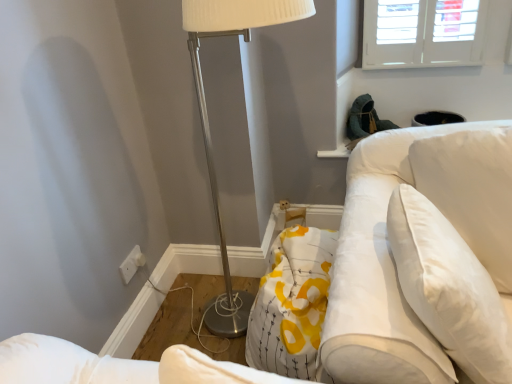
Question: Is metallic silver floor lamp at center facing towards white fabric swivel chair at right?

Choices:
 (A) no
 (B) yes

Answer: (A)

Question: Is metallic silver floor lamp at center beside white fabric swivel chair at right?

Choices:
 (A) no
 (B) yes

Answer: (A)

Question: Is metallic silver floor lamp at center in front of white fabric swivel chair at right?

Choices:
 (A) no
 (B) yes

Answer: (B)

Question: Can you confirm if metallic silver floor lamp at center is bigger than white fabric swivel chair at right?

Choices:
 (A) yes
 (B) no

Answer: (A)

Question: Is metallic silver floor lamp at center at the left side of white fabric swivel chair at right?

Choices:
 (A) no
 (B) yes

Answer: (B)

Question: Based on their sizes in the image, would you say white soft pillow at upper right is bigger or smaller than white plastic electric outlet at lower left?

Choices:
 (A) big
 (B) small

Answer: (A)

Question: From a real-world perspective, relative to white plastic electric outlet at lower left, is white soft pillow at upper right vertically above or below?

Choices:
 (A) above
 (B) below

Answer: (A)

Question: Does point (466, 339) appear closer or farther from the camera than point (124, 271)?

Choices:
 (A) farther
 (B) closer

Answer: (B)

Question: From the image's perspective, relative to white plastic electric outlet at lower left, is white soft pillow at upper right above or below?

Choices:
 (A) above
 (B) below

Answer: (A)

Question: Does point (203, 114) appear closer or farther from the camera than point (128, 274)?

Choices:
 (A) farther
 (B) closer

Answer: (A)

Question: Is metallic silver floor lamp at center inside or outside of white plastic electric outlet at lower left?

Choices:
 (A) outside
 (B) inside

Answer: (A)

Question: Is metallic silver floor lamp at center taller or shorter than white plastic electric outlet at lower left?

Choices:
 (A) tall
 (B) short

Answer: (A)

Question: From a real-world perspective, is metallic silver floor lamp at center physically located above or below white plastic electric outlet at lower left?

Choices:
 (A) above
 (B) below

Answer: (A)

Question: Looking at their shapes, would you say white fabric swivel chair at right is wider or thinner than metallic silver floor lamp at center?

Choices:
 (A) thin
 (B) wide

Answer: (B)

Question: From a real-world perspective, is white fabric swivel chair at right physically located above or below metallic silver floor lamp at center?

Choices:
 (A) above
 (B) below

Answer: (B)